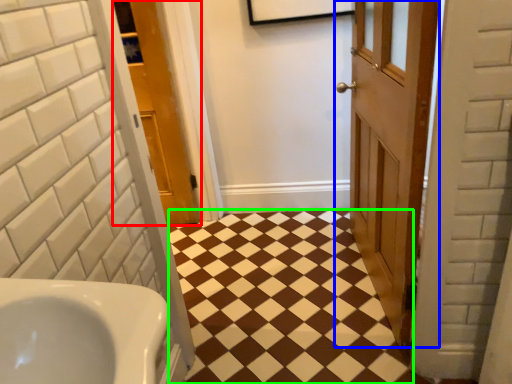
Question: Which is nearer to the door (highlighted by a red box)? door (highlighted by a blue box) or square (highlighted by a green box).

Choices:
 (A) door
 (B) square

Answer: (B)